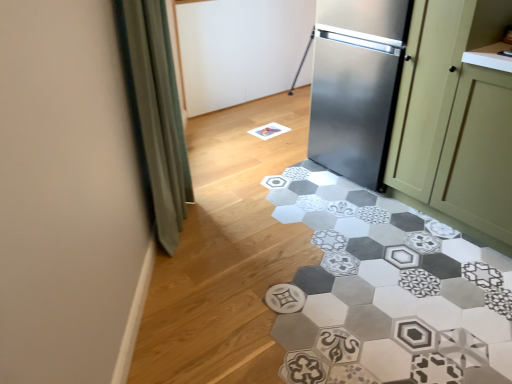
You are a GUI agent. You are given a task and a screenshot of the screen. Output one action in this format:
    pyautogui.click(x=<x>, y=<y>)
    Task: Click on the vacant area that is in front of stainless steel cabinet at right
    
    Given the screenshot: What is the action you would take?
    pyautogui.click(x=380, y=240)